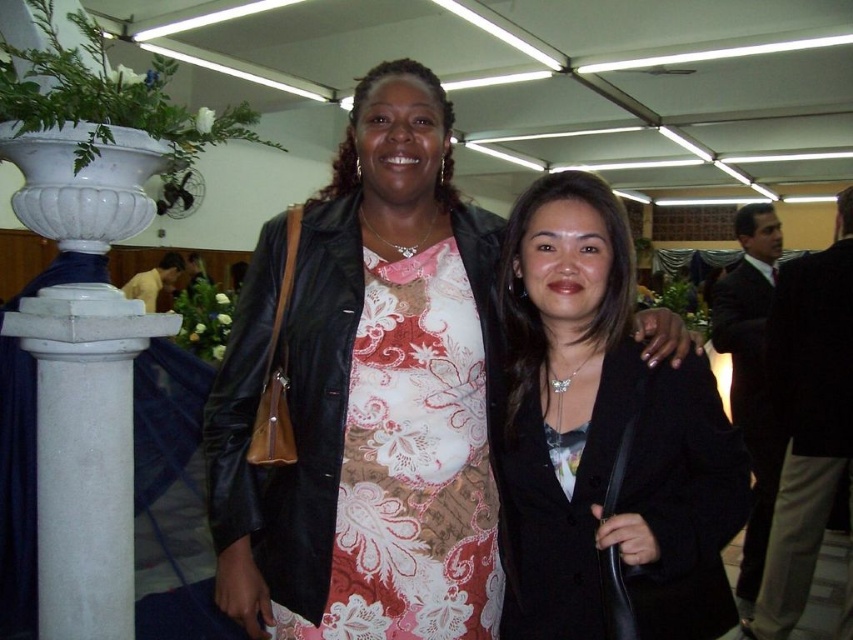
Does matte black leather jacket at center have a greater width compared to floral-patterned fabric dress at center?

Indeed, matte black leather jacket at center has a greater width compared to floral-patterned fabric dress at center.

Between point (328, 472) and point (358, 544), which one is positioned in front?

Point (328, 472)

What do you see at coordinates (366, 396) in the screenshot?
I see `matte black leather jacket at center` at bounding box center [366, 396].

Identify the location of matte black leather jacket at center. (366, 396).

Can you confirm if matte black leather jacket at center is wider than black leather jacket at center?

Yes, matte black leather jacket at center is wider than black leather jacket at center.

The height and width of the screenshot is (640, 853). What do you see at coordinates (366, 396) in the screenshot?
I see `matte black leather jacket at center` at bounding box center [366, 396].

Where is `matte black leather jacket at center`? The image size is (853, 640). matte black leather jacket at center is located at coordinates (366, 396).

Which is below, black leather jacket at center or black suit at right?

black suit at right is below.

Is black leather jacket at center below black suit at right?

No.

Is point (611, 269) less distant than point (757, 532)?

That is True.

At what (x,y) coordinates should I click in order to perform the action: click on black leather jacket at center. Please return your answer as a coordinate pair (x, y). The height and width of the screenshot is (640, 853). Looking at the image, I should click on (605, 435).